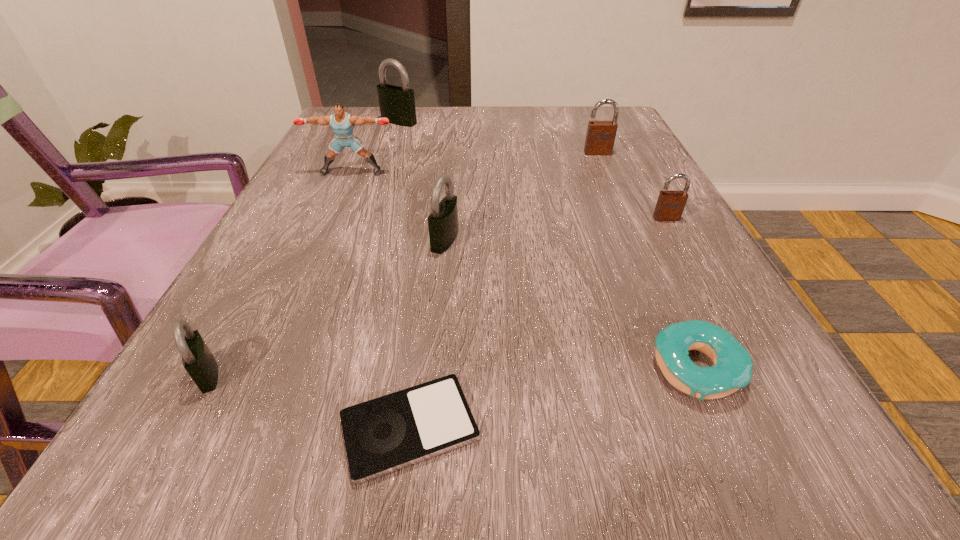
The height and width of the screenshot is (540, 960). In order to click on unoccupied area between the farthest object and the fifth nearest object in this screenshot , I will do `click(533, 170)`.

The width and height of the screenshot is (960, 540). Find the location of `unoccupied area between the second padlock from right to left and the fifth nearest object`. unoccupied area between the second padlock from right to left and the fifth nearest object is located at coordinates (632, 185).

Where is `empty space that is in between the puncher and the rightmost padlock`? empty space that is in between the puncher and the rightmost padlock is located at coordinates (509, 195).

Locate an element on the screen. This screenshot has height=540, width=960. object that can be found as the third closest to the red puncher is located at coordinates (600, 137).

Select which object appears as the third closest to the left brown padlock. Please provide its 2D coordinates. Your answer should be formatted as a tuple, i.e. [(x, y)], where the tuple contains the x and y coordinates of a point satisfying the conditions above.

[(397, 104)]

I want to click on the third closest padlock to the iPod, so click(670, 205).

This screenshot has width=960, height=540. Identify the location of padlock that is the fourth closest to the doughnut. 199,362.

Locate which black padlock ranks in proximity to the fifth farthest object. Please provide its 2D coordinates. Your answer should be formatted as a tuple, i.e. [(x, y)], where the tuple contains the x and y coordinates of a point satisfying the conditions above.

[(199, 362)]

Locate an element on the screen. black padlock object that ranks as the second closest to the iPod is located at coordinates (443, 220).

Locate an element on the screen. The width and height of the screenshot is (960, 540). free region that satisfies the following two spatial constraints: 1. on the front-facing side of the third padlock from right to left; 2. on the right side of the puncher is located at coordinates (322, 240).